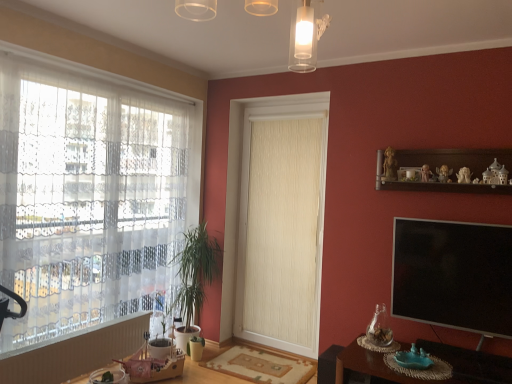
At what (x,y) coordinates should I click in order to perform the action: click on blank space above brown wooden table at lower right (from a real-world perspective). Please return your answer as a coordinate pair (x, y). Image resolution: width=512 pixels, height=384 pixels. Looking at the image, I should click on (425, 366).